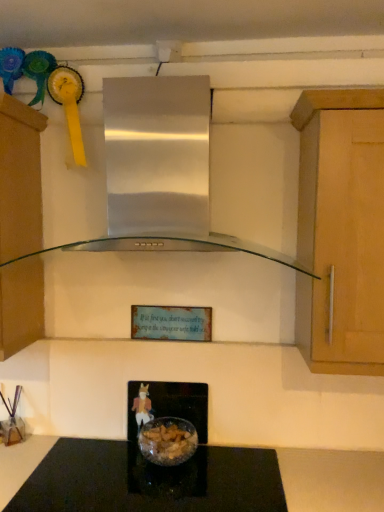
This screenshot has height=512, width=384. Identify the location of free space above translucent glass bowl at center (from a real-world perspective). (181, 429).